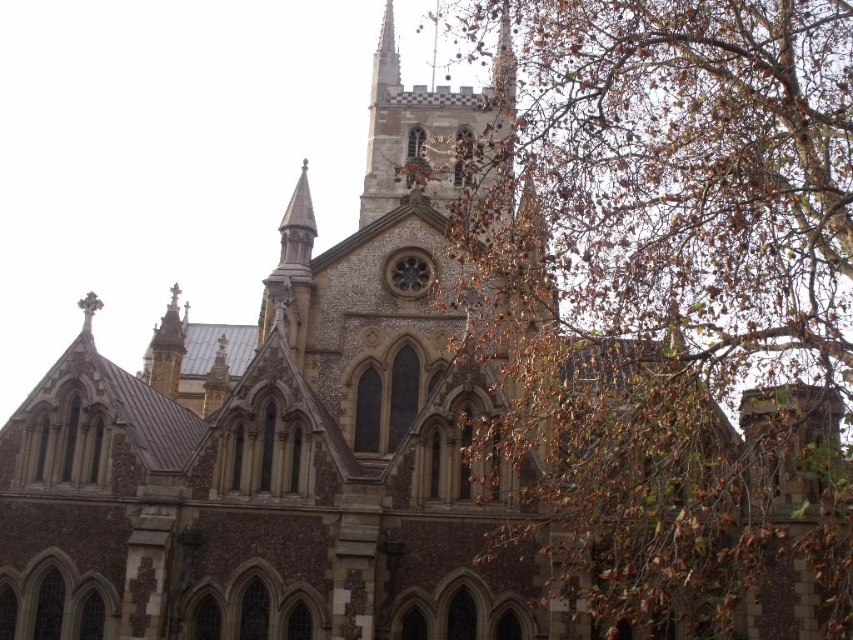
Looking at this image, does brown leafy branches at upper right have a greater height compared to brown stone clock tower at center?

Correct, brown leafy branches at upper right is much taller as brown stone clock tower at center.

In the scene shown: Is brown leafy branches at upper right to the right of brown stone clock tower at center from the viewer's perspective?

Correct, you'll find brown leafy branches at upper right to the right of brown stone clock tower at center.

Who is more forward, (805, 342) or (375, 173)?

Point (805, 342)

You are a GUI agent. You are given a task and a screenshot of the screen. Output one action in this format:
    pyautogui.click(x=<x>, y=<y>)
    Task: Click on the brown leafy branches at upper right
    
    Given the screenshot: What is the action you would take?
    pyautogui.click(x=666, y=289)